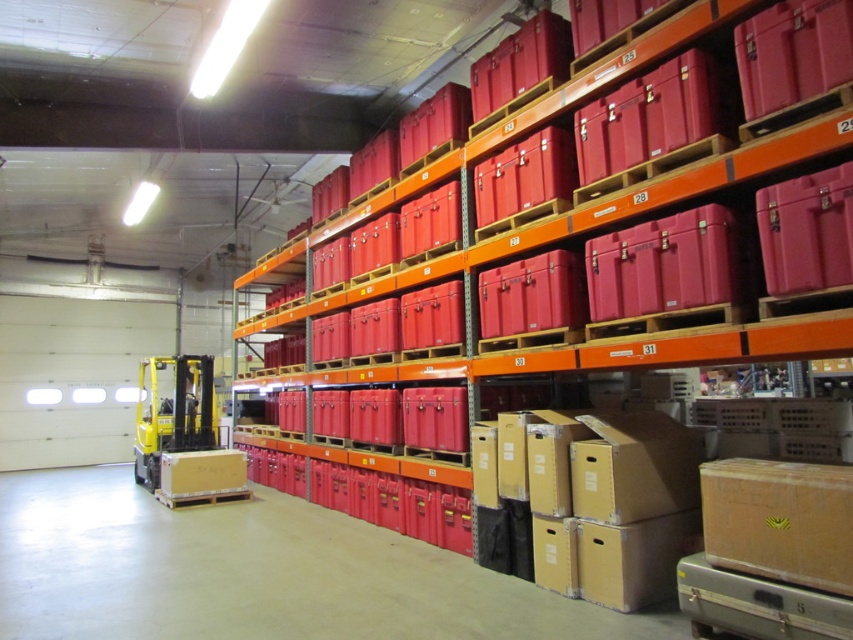
You are a warehouse worker who needs to stack the matte red container at upper center and the brown cardboard box at lower right. Which one should you place on top to ensure stability?

The matte red container at upper center should be placed on top of the brown cardboard box at lower right because it is smaller and thus more stable to stack that way.